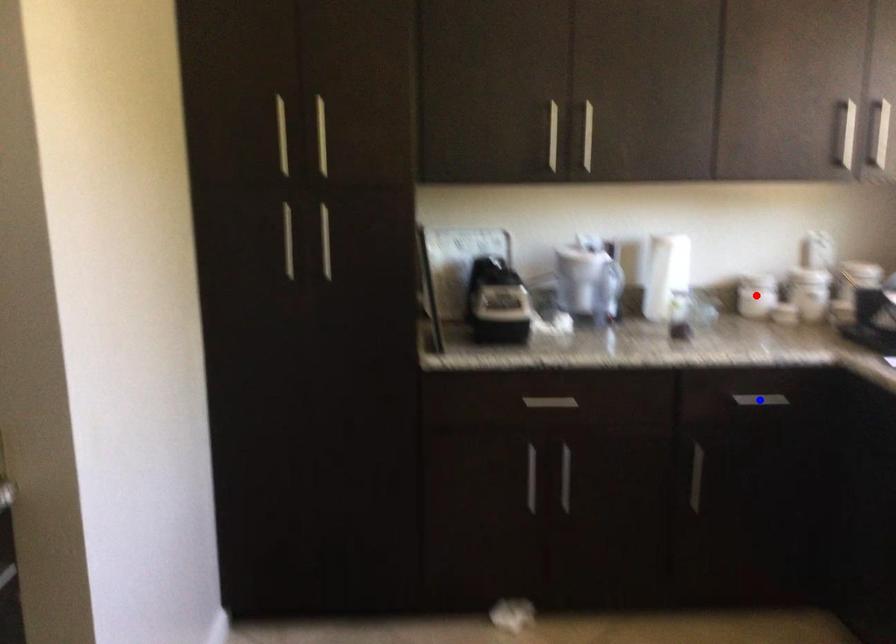
Question: In the image, two points are highlighted. Which point is nearer to the camera? Reply with the corresponding letter.

Choices:
 (A) blue point
 (B) red point

Answer: (A)